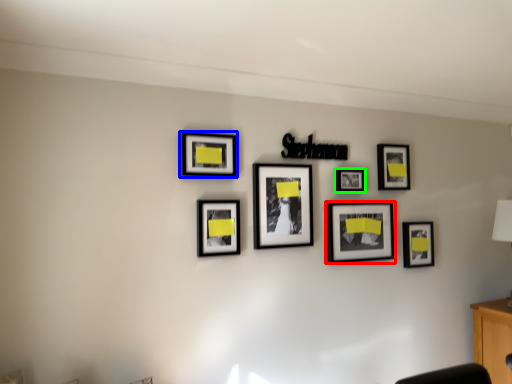
Question: Which object is positioned closest to picture frame (highlighted by a red box)? Select from picture frame (highlighted by a blue box) and picture frame (highlighted by a green box).

Choices:
 (A) picture frame
 (B) picture frame

Answer: (B)